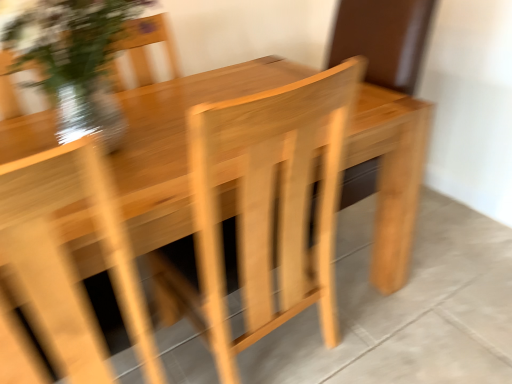
What are the coordinates of `vacant area that is situated to the right of natural wood armchair at center` in the screenshot? It's located at (401, 335).